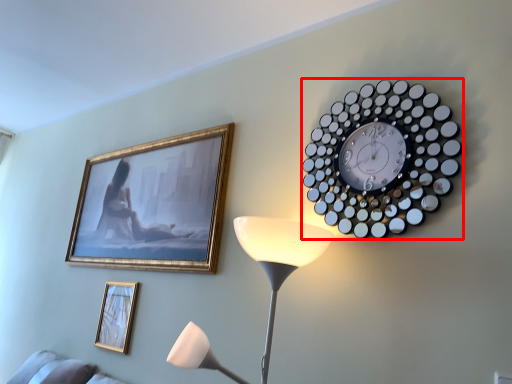
Question: Considering the relative positions of wall clock (annotated by the red box) and picture frame in the image provided, where is wall clock (annotated by the red box) located with respect to the staircase?

Choices:
 (A) right
 (B) left

Answer: (A)